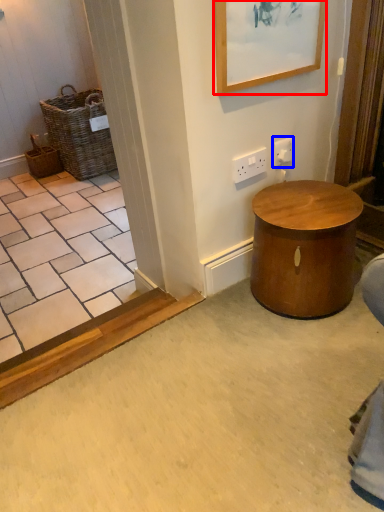
Question: Among these objects, which one is nearest to the camera, picture frame (highlighted by a red box) or electric outlet (highlighted by a blue box)?

Choices:
 (A) picture frame
 (B) electric outlet

Answer: (A)